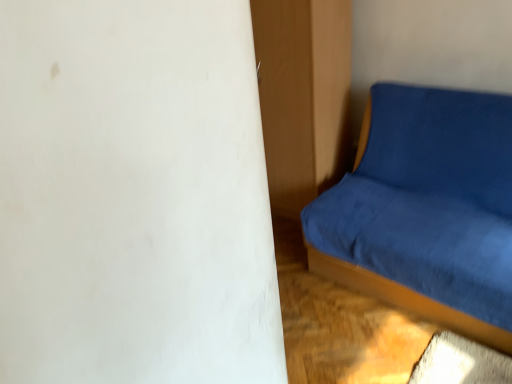
What do you see at coordinates (303, 96) in the screenshot?
I see `matte wood dresser at center` at bounding box center [303, 96].

The image size is (512, 384). Identify the location of matte wood dresser at center. (303, 96).

Image resolution: width=512 pixels, height=384 pixels. Find the location of `blue fabric studio couch at right`. blue fabric studio couch at right is located at coordinates (426, 209).

What do you see at coordinates (426, 209) in the screenshot? The width and height of the screenshot is (512, 384). I see `blue fabric studio couch at right` at bounding box center [426, 209].

Find the location of a particular element. matte wood dresser at center is located at coordinates point(303,96).

Between matte wood dresser at center and blue fabric studio couch at right, which one appears on the right side from the viewer's perspective?

blue fabric studio couch at right is more to the right.

Is matte wood dresser at center in front of or behind blue fabric studio couch at right in the image?

In the image, matte wood dresser at center appears behind blue fabric studio couch at right.

Which is closer to the camera, (270, 143) or (499, 277)?

Point (270, 143) appears to be farther away from the viewer than point (499, 277).

From the image's perspective, would you say matte wood dresser at center is positioned over blue fabric studio couch at right?

Yes, from the image's perspective, matte wood dresser at center is over blue fabric studio couch at right.

From a real-world perspective, which object stands above the other?

matte wood dresser at center, from a real-world perspective.

Which of these two, matte wood dresser at center or blue fabric studio couch at right, is wider?

With larger width is blue fabric studio couch at right.

Considering the sizes of objects matte wood dresser at center and blue fabric studio couch at right in the image provided, who is shorter, matte wood dresser at center or blue fabric studio couch at right?

blue fabric studio couch at right is shorter.

Between matte wood dresser at center and blue fabric studio couch at right, which one has larger size?

blue fabric studio couch at right is bigger.

Is blue fabric studio couch at right completely or partially inside matte wood dresser at center?

No, blue fabric studio couch at right is not inside matte wood dresser at center.

From the picture: Is matte wood dresser at center not near blue fabric studio couch at right?

Actually, matte wood dresser at center and blue fabric studio couch at right are a little close together.

Is blue fabric studio couch at right at the back of matte wood dresser at center?

No, blue fabric studio couch at right is not at the back of matte wood dresser at center.

At what (x,y) coordinates should I click in order to perform the action: click on studio couch on the right of the matte wood dresser at center. Please return your answer as a coordinate pair (x, y). The image size is (512, 384). Looking at the image, I should click on (426, 209).

Is blue fabric studio couch at right to the right of matte wood dresser at center from the viewer's perspective?

Correct, you'll find blue fabric studio couch at right to the right of matte wood dresser at center.

Considering their positions, is blue fabric studio couch at right located in front of or behind matte wood dresser at center?

In the image, blue fabric studio couch at right appears in front of matte wood dresser at center.

Which is closer to the camera, (455, 153) or (329, 80)?

Point (455, 153)

From the image's perspective, is blue fabric studio couch at right positioned above or below matte wood dresser at center?

blue fabric studio couch at right is situated lower than matte wood dresser at center in the image.

From a real-world perspective, is blue fabric studio couch at right positioned above or below matte wood dresser at center?

From a real-world perspective, blue fabric studio couch at right is physically below matte wood dresser at center.

In terms of width, does blue fabric studio couch at right look wider or thinner when compared to matte wood dresser at center?

Considering their sizes, blue fabric studio couch at right looks broader than matte wood dresser at center.

Which of these two, blue fabric studio couch at right or matte wood dresser at center, stands shorter?

blue fabric studio couch at right.

Looking at the image, does blue fabric studio couch at right seem bigger or smaller compared to matte wood dresser at center?

blue fabric studio couch at right is bigger than matte wood dresser at center.

Consider the image. Is blue fabric studio couch at right outside of matte wood dresser at center?

Yes.

Is blue fabric studio couch at right directly adjacent to matte wood dresser at center?

No, blue fabric studio couch at right is not with matte wood dresser at center.

Is matte wood dresser at center at the back of blue fabric studio couch at right?

No, blue fabric studio couch at right is not facing the opposite direction of matte wood dresser at center.

Can you tell me how much blue fabric studio couch at right and matte wood dresser at center differ in facing direction?

The angle between the facing direction of blue fabric studio couch at right and the facing direction of matte wood dresser at center is 2 degrees.

This screenshot has width=512, height=384. Identify the location of dresser that is on the left side of blue fabric studio couch at right. (303, 96).

Identify the location of studio couch below the matte wood dresser at center (from a real-world perspective). (426, 209).

Where is `dresser that appears above the blue fabric studio couch at right (from a real-world perspective)`? This screenshot has height=384, width=512. dresser that appears above the blue fabric studio couch at right (from a real-world perspective) is located at coordinates (303, 96).